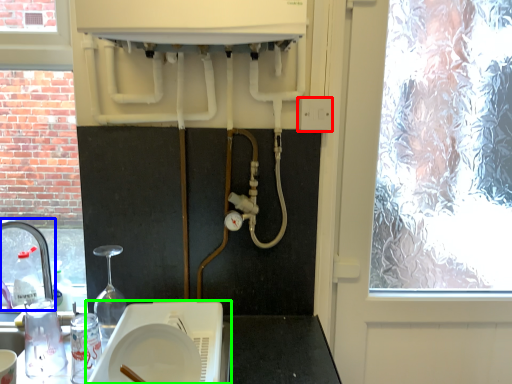
Question: Which is nearer to the electric outlet (highlighted by a red box)? tap (highlighted by a blue box) or appliance (highlighted by a green box).

Choices:
 (A) tap
 (B) appliance

Answer: (B)